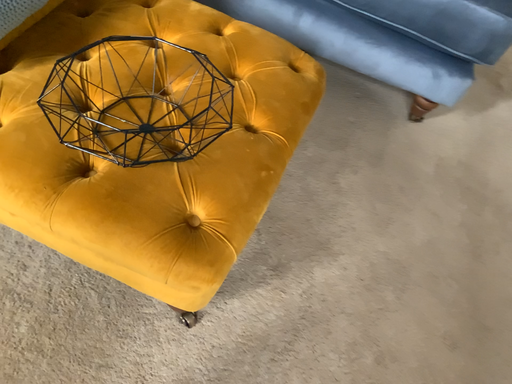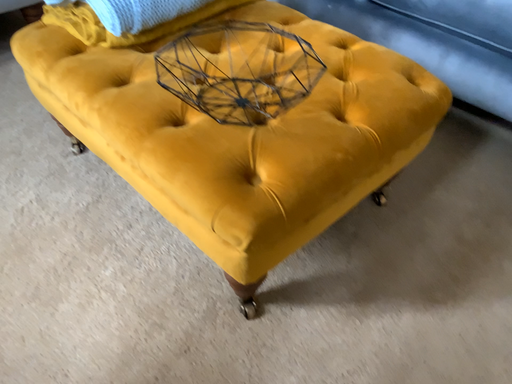
Question: How did the camera likely rotate when shooting the video?

Choices:
 (A) rotated upward
 (B) rotated downward

Answer: (A)